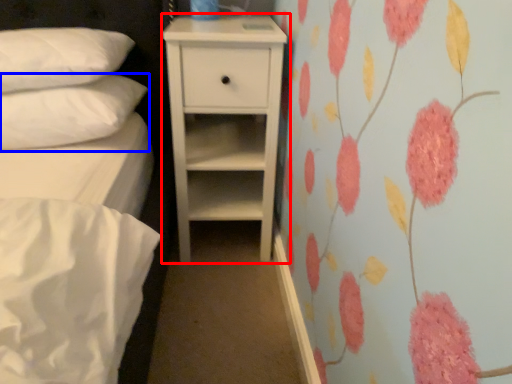
Question: Which of the following is the closest to the observer, chest of drawers (highlighted by a red box) or pillow (highlighted by a blue box)?

Choices:
 (A) chest of drawers
 (B) pillow

Answer: (B)